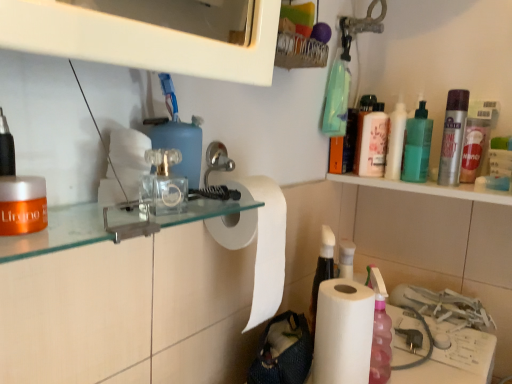
Question: Is clear plastic toilet paper at center surrounding green translucent bottle at upper right, acting as the 2th mouthwash starting from the back?

Choices:
 (A) no
 (B) yes

Answer: (A)

Question: From a real-world perspective, does clear plastic toilet paper at center sit lower than green translucent bottle at upper right, the second mouthwash in the right-to-left sequence?

Choices:
 (A) yes
 (B) no

Answer: (A)

Question: Can we say clear plastic toilet paper at center lies outside green translucent bottle at upper right, the third mouthwash in the front-to-back sequence?

Choices:
 (A) yes
 (B) no

Answer: (A)

Question: Is clear plastic toilet paper at center turned away from green translucent bottle at upper right, the third mouthwash in the front-to-back sequence?

Choices:
 (A) yes
 (B) no

Answer: (B)

Question: Can you confirm if clear plastic toilet paper at center is taller than green translucent bottle at upper right, the third mouthwash in the front-to-back sequence?

Choices:
 (A) no
 (B) yes

Answer: (A)

Question: From a real-world perspective, is clear plastic toilet paper at center on green translucent bottle at upper right, which is the third mouthwash in left-to-right order?

Choices:
 (A) no
 (B) yes

Answer: (A)

Question: Considering the relative sizes of clear plastic toilet paper at center and orange matte jar at left in the image provided, is clear plastic toilet paper at center bigger than orange matte jar at left?

Choices:
 (A) no
 (B) yes

Answer: (A)

Question: Can you confirm if clear plastic toilet paper at center is thinner than orange matte jar at left?

Choices:
 (A) yes
 (B) no

Answer: (A)

Question: Would you say orange matte jar at left is part of clear plastic toilet paper at center's contents?

Choices:
 (A) yes
 (B) no

Answer: (B)

Question: Does clear plastic toilet paper at center come behind orange matte jar at left?

Choices:
 (A) no
 (B) yes

Answer: (B)

Question: Is clear plastic toilet paper at center touching orange matte jar at left?

Choices:
 (A) no
 (B) yes

Answer: (B)

Question: Considering the relative sizes of clear plastic toilet paper at center and orange matte jar at left in the image provided, is clear plastic toilet paper at center smaller than orange matte jar at left?

Choices:
 (A) no
 (B) yes

Answer: (B)

Question: From a real-world perspective, does orange matte jar at left stand above silver metallic mouthwash at upper right, positioned as the 4th mouthwash in left-to-right order?

Choices:
 (A) no
 (B) yes

Answer: (A)